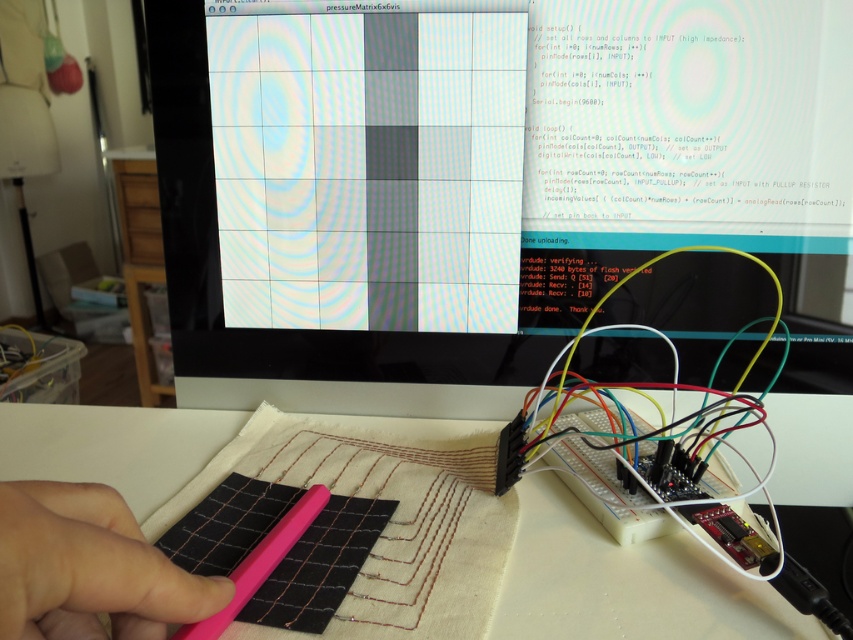
Question: In this image, where is matte plastic monitor at center located relative to pink rubber at lower left?

Choices:
 (A) right
 (B) left

Answer: (A)

Question: Which point appears farthest from the camera in this image?

Choices:
 (A) (260, 547)
 (B) (16, 515)
 (C) (209, 445)

Answer: (C)

Question: Which object is farther from the camera taking this photo?

Choices:
 (A) pink plastic pen at center
 (B) pink rubber at lower left
 (C) matte plastic monitor at center

Answer: (C)

Question: Among these points, which one is farthest from the camera?

Choices:
 (A) (467, 349)
 (B) (90, 474)
 (C) (65, 564)
 (D) (294, 520)

Answer: (A)

Question: Does matte plastic monitor at center appear on the left side of pink plastic pen at center?

Choices:
 (A) no
 (B) yes

Answer: (A)

Question: Where is pink rubber at lower left located in relation to pink plastic pen at center in the image?

Choices:
 (A) left
 (B) right

Answer: (A)